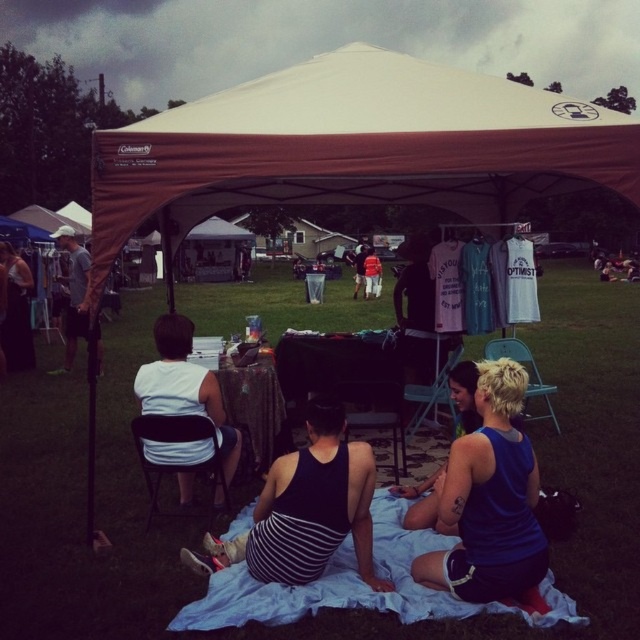
You are organizing a picnic and need to decide which item to use as a seating area. Given the blue fabric blanket at lower center and the white fabric shirt at left, which one would you choose and why?

The blue fabric blanket at lower center is the better choice for a seating area because it is smaller in size compared to the white fabric shirt at left, making it more suitable for covering the ground comfortably.

You are standing at the entrance of the beige canopy tent and want to reach the point marked as point [228,442]. If your walking speed is 1.2 meters per second, how many seconds will it take you to reach that point?

The distance between you and point [228,442] is 4.42 meters. At a speed of 1.2 meters per second, it will take approximately 3.68 seconds to reach the point.